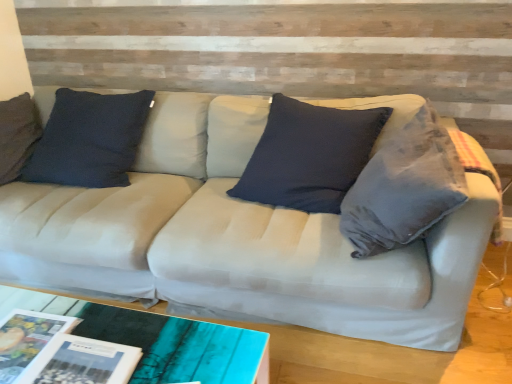
Find the location of a particular element. matte paper magazine at lower left, the 1th magazine when ordered from left to right is located at coordinates (27, 339).

In order to face matte paper magazine at lower left, the 1th magazine when ordered from left to right, should I rotate leftwards or rightwards?

To align with it, rotate left about 29.571°.

The width and height of the screenshot is (512, 384). What do you see at coordinates (27, 339) in the screenshot?
I see `matte paper magazine at lower left, the 1th magazine when ordered from left to right` at bounding box center [27, 339].

What is the approximate width of matte paper magazine at lower left, which is the 2th magazine in right-to-left order?

matte paper magazine at lower left, which is the 2th magazine in right-to-left order, is 11.85 inches wide.

What is the approximate height of matte paper magazine at lower left, the 1th magazine in the right-to-left sequence?

The height of matte paper magazine at lower left, the 1th magazine in the right-to-left sequence, is 8.47 centimeters.

Where is `matte paper magazine at lower left, the 1th magazine in the right-to-left sequence`? The image size is (512, 384). matte paper magazine at lower left, the 1th magazine in the right-to-left sequence is located at coordinates click(82, 362).

This screenshot has height=384, width=512. What do you see at coordinates (82, 362) in the screenshot? I see `matte paper magazine at lower left, which is counted as the second magazine, starting from the left` at bounding box center [82, 362].

The image size is (512, 384). What are the coordinates of `matte paper magazine at lower left, which is the 2th magazine in right-to-left order` in the screenshot? It's located at (27, 339).

Is matte paper magazine at lower left, the 1th magazine in the right-to-left sequence, to the right of matte paper magazine at lower left, the 1th magazine when ordered from left to right, from the viewer's perspective?

Yes.

Is the position of matte paper magazine at lower left, the 1th magazine in the right-to-left sequence, more distant than that of matte paper magazine at lower left, the 1th magazine when ordered from left to right?

No.

Considering the positions of point (94, 374) and point (61, 326), is point (94, 374) closer or farther from the camera than point (61, 326)?

Point (94, 374) is positioned closer to the camera compared to point (61, 326).

Based on the photo, from the image's perspective, is matte paper magazine at lower left, the 1th magazine in the right-to-left sequence, over matte paper magazine at lower left, which is the 2th magazine in right-to-left order?

No.

From a real-world perspective, is matte paper magazine at lower left, which is counted as the second magazine, starting from the left, located beneath matte paper magazine at lower left, which is the 2th magazine in right-to-left order?

No, from a real-world perspective, matte paper magazine at lower left, which is counted as the second magazine, starting from the left, is not under matte paper magazine at lower left, which is the 2th magazine in right-to-left order.

Considering the sizes of objects matte paper magazine at lower left, the 1th magazine in the right-to-left sequence, and matte paper magazine at lower left, which is the 2th magazine in right-to-left order, in the image provided, who is wider, matte paper magazine at lower left, the 1th magazine in the right-to-left sequence, or matte paper magazine at lower left, which is the 2th magazine in right-to-left order,?

matte paper magazine at lower left, the 1th magazine in the right-to-left sequence, is wider.

From their relative heights in the image, would you say matte paper magazine at lower left, which is counted as the second magazine, starting from the left, is taller or shorter than matte paper magazine at lower left, the 1th magazine when ordered from left to right?

In the image, matte paper magazine at lower left, which is counted as the second magazine, starting from the left, appears to be taller than matte paper magazine at lower left, the 1th magazine when ordered from left to right.

Is matte paper magazine at lower left, the 1th magazine in the right-to-left sequence, smaller than matte paper magazine at lower left, the 1th magazine when ordered from left to right?

Actually, matte paper magazine at lower left, the 1th magazine in the right-to-left sequence, might be larger than matte paper magazine at lower left, the 1th magazine when ordered from left to right.

Is matte paper magazine at lower left, which is counted as the second magazine, starting from the left, completely or partially outside of matte paper magazine at lower left, the 1th magazine when ordered from left to right?

Yes.

Is matte paper magazine at lower left, the 1th magazine in the right-to-left sequence, next to matte paper magazine at lower left, the 1th magazine when ordered from left to right?

No, matte paper magazine at lower left, the 1th magazine in the right-to-left sequence, is not making contact with matte paper magazine at lower left, the 1th magazine when ordered from left to right.

Is matte paper magazine at lower left, the 1th magazine in the right-to-left sequence, oriented towards matte paper magazine at lower left, the 1th magazine when ordered from left to right?

No, matte paper magazine at lower left, the 1th magazine in the right-to-left sequence, does not turn towards matte paper magazine at lower left, the 1th magazine when ordered from left to right.

Could you measure the distance between matte paper magazine at lower left, the 1th magazine in the right-to-left sequence, and matte paper magazine at lower left, which is the 2th magazine in right-to-left order?

matte paper magazine at lower left, the 1th magazine in the right-to-left sequence, and matte paper magazine at lower left, which is the 2th magazine in right-to-left order, are 4.73 inches apart.

This screenshot has height=384, width=512. What are the coordinates of `magazine to the left of matte paper magazine at lower left, which is counted as the second magazine, starting from the left` in the screenshot? It's located at (27, 339).

Based on their positions, is matte paper magazine at lower left, the 1th magazine when ordered from left to right, located to the left or right of matte paper magazine at lower left, the 1th magazine in the right-to-left sequence?

matte paper magazine at lower left, the 1th magazine when ordered from left to right, is to the left of matte paper magazine at lower left, the 1th magazine in the right-to-left sequence.

Which object is further away from the camera taking this photo, matte paper magazine at lower left, which is the 2th magazine in right-to-left order, or matte paper magazine at lower left, the 1th magazine in the right-to-left sequence?

Positioned behind is matte paper magazine at lower left, which is the 2th magazine in right-to-left order.

Is point (3, 358) closer or farther from the camera than point (81, 348)?

Point (3, 358) is positioned farther from the camera compared to point (81, 348).

From the image's perspective, which is below, matte paper magazine at lower left, which is the 2th magazine in right-to-left order, or matte paper magazine at lower left, the 1th magazine in the right-to-left sequence?

matte paper magazine at lower left, the 1th magazine in the right-to-left sequence, appears lower in the image.

From a real-world perspective, is matte paper magazine at lower left, which is the 2th magazine in right-to-left order, physically located above or below matte paper magazine at lower left, the 1th magazine in the right-to-left sequence?

matte paper magazine at lower left, which is the 2th magazine in right-to-left order, is below matte paper magazine at lower left, the 1th magazine in the right-to-left sequence.

Looking at their sizes, would you say matte paper magazine at lower left, which is the 2th magazine in right-to-left order, is wider or thinner than matte paper magazine at lower left, the 1th magazine in the right-to-left sequence?

matte paper magazine at lower left, which is the 2th magazine in right-to-left order, is thinner than matte paper magazine at lower left, the 1th magazine in the right-to-left sequence.

Considering the sizes of objects matte paper magazine at lower left, which is the 2th magazine in right-to-left order, and matte paper magazine at lower left, the 1th magazine in the right-to-left sequence, in the image provided, who is shorter, matte paper magazine at lower left, which is the 2th magazine in right-to-left order, or matte paper magazine at lower left, the 1th magazine in the right-to-left sequence,?

matte paper magazine at lower left, which is the 2th magazine in right-to-left order.

Looking at the image, does matte paper magazine at lower left, which is the 2th magazine in right-to-left order, seem bigger or smaller compared to matte paper magazine at lower left, the 1th magazine in the right-to-left sequence?

Clearly, matte paper magazine at lower left, which is the 2th magazine in right-to-left order, is smaller in size than matte paper magazine at lower left, the 1th magazine in the right-to-left sequence.

Is matte paper magazine at lower left, the 1th magazine when ordered from left to right, inside the boundaries of matte paper magazine at lower left, which is counted as the second magazine, starting from the left, or outside?

matte paper magazine at lower left, the 1th magazine when ordered from left to right, exists outside the volume of matte paper magazine at lower left, which is counted as the second magazine, starting from the left.

Is matte paper magazine at lower left, the 1th magazine when ordered from left to right, positioned far away from matte paper magazine at lower left, the 1th magazine in the right-to-left sequence?

matte paper magazine at lower left, the 1th magazine when ordered from left to right, is near matte paper magazine at lower left, the 1th magazine in the right-to-left sequence, not far away.

Is matte paper magazine at lower left, the 1th magazine when ordered from left to right, aimed at matte paper magazine at lower left, the 1th magazine in the right-to-left sequence?

No, matte paper magazine at lower left, the 1th magazine when ordered from left to right, is not turned towards matte paper magazine at lower left, the 1th magazine in the right-to-left sequence.

What's the angular difference between matte paper magazine at lower left, the 1th magazine when ordered from left to right, and matte paper magazine at lower left, the 1th magazine in the right-to-left sequence,'s facing directions?

5.98 degrees.

Identify the location of magazine above the matte paper magazine at lower left, the 1th magazine when ordered from left to right (from a real-world perspective). This screenshot has width=512, height=384. (82, 362).

Locate an element on the screen. This screenshot has width=512, height=384. magazine on the left side of matte paper magazine at lower left, which is counted as the second magazine, starting from the left is located at coordinates (27, 339).

Locate an element on the screen. The height and width of the screenshot is (384, 512). magazine behind the matte paper magazine at lower left, the 1th magazine in the right-to-left sequence is located at coordinates (27, 339).